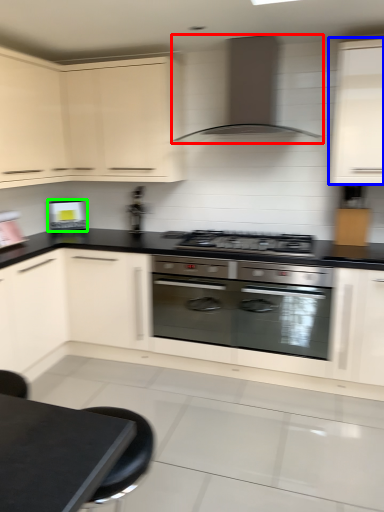
Question: Which is farther away from home appliance (highlighted by a red box)? cabinetry (highlighted by a blue box) or kitchen appliance (highlighted by a green box)?

Choices:
 (A) cabinetry
 (B) kitchen appliance

Answer: (B)